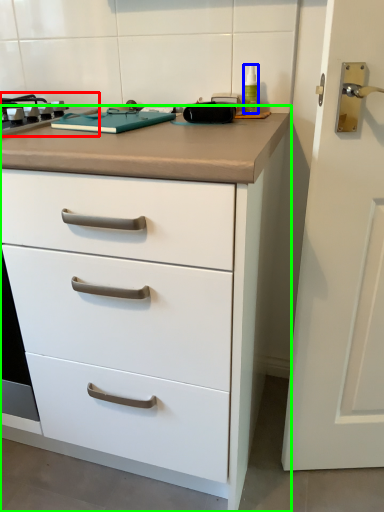
Question: Which object is positioned closest to gas stove (highlighted by a red box)? Select from bottle (highlighted by a blue box) and chest of drawers (highlighted by a green box).

Choices:
 (A) bottle
 (B) chest of drawers

Answer: (B)